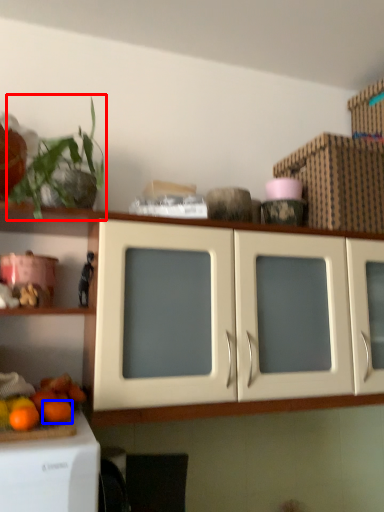
Question: Which point is further to the camera, plant (highlighted by a red box) or orange (highlighted by a blue box)?

Choices:
 (A) plant
 (B) orange

Answer: (B)